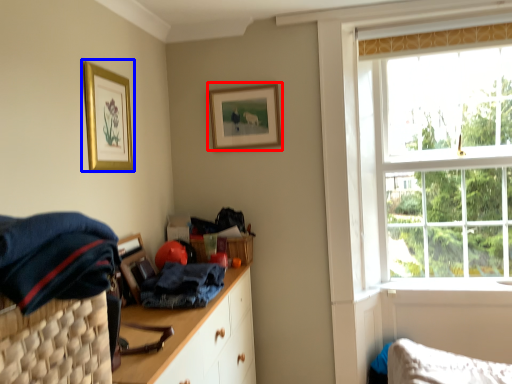
Question: Which of the following is the farthest to the observer, picture frame (highlighted by a red box) or picture frame (highlighted by a blue box)?

Choices:
 (A) picture frame
 (B) picture frame

Answer: (A)